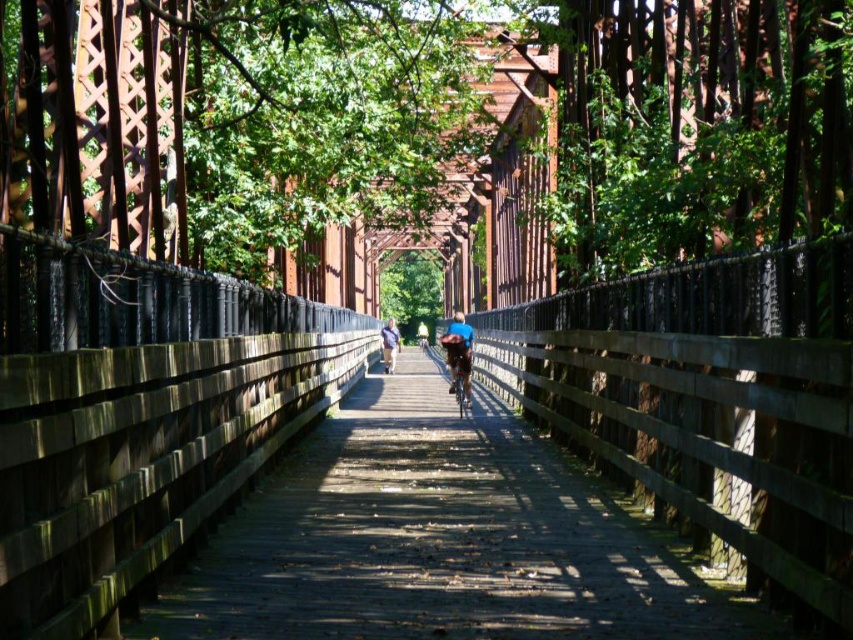
From the picture: Which is more to the left, wooden planks at center or shiny metallic bicycle at center?

wooden planks at center

Locate an element on the screen. Image resolution: width=853 pixels, height=640 pixels. wooden planks at center is located at coordinates (438, 540).

Between point (236, 588) and point (422, 342), which one is positioned behind?

The point (422, 342) is behind.

Where is `wooden planks at center`? This screenshot has width=853, height=640. wooden planks at center is located at coordinates (438, 540).

Between wooden planks at center and blue denim jacket at center, which one is positioned lower?

Positioned lower is wooden planks at center.

Does wooden planks at center have a greater width compared to blue denim jacket at center?

Correct, the width of wooden planks at center exceeds that of blue denim jacket at center.

Is point (575, 611) positioned behind point (386, 372)?

No, (575, 611) is in front of (386, 372).

The height and width of the screenshot is (640, 853). Identify the location of wooden planks at center. (438, 540).